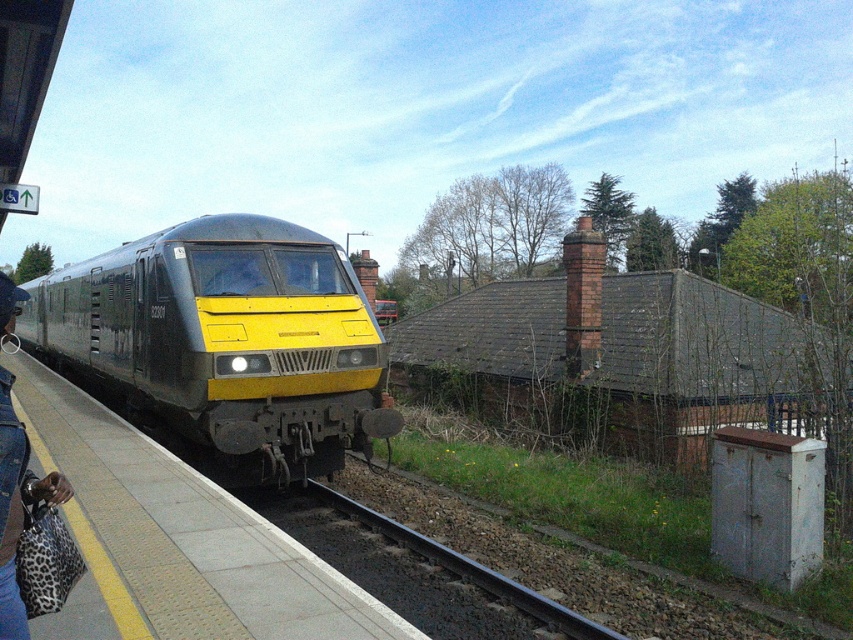
Question: Which point appears closest to the camera in this image?

Choices:
 (A) (19, 442)
 (B) (386, 396)
 (C) (170, 570)

Answer: (A)

Question: Which point is farther to the camera?

Choices:
 (A) black gravel train track at lower center
 (B) concrete platform at center
 (C) leopard print bag at platform left

Answer: (A)

Question: Is metallic yellow train at center above leopard print bag at platform left?

Choices:
 (A) yes
 (B) no

Answer: (A)

Question: Is metallic yellow train at center smaller than concrete platform at center?

Choices:
 (A) no
 (B) yes

Answer: (A)

Question: Is concrete platform at center smaller than leopard print bag at platform left?

Choices:
 (A) no
 (B) yes

Answer: (A)

Question: Among these objects, which one is nearest to the camera?

Choices:
 (A) leopard print bag at platform left
 (B) concrete platform at center

Answer: (A)